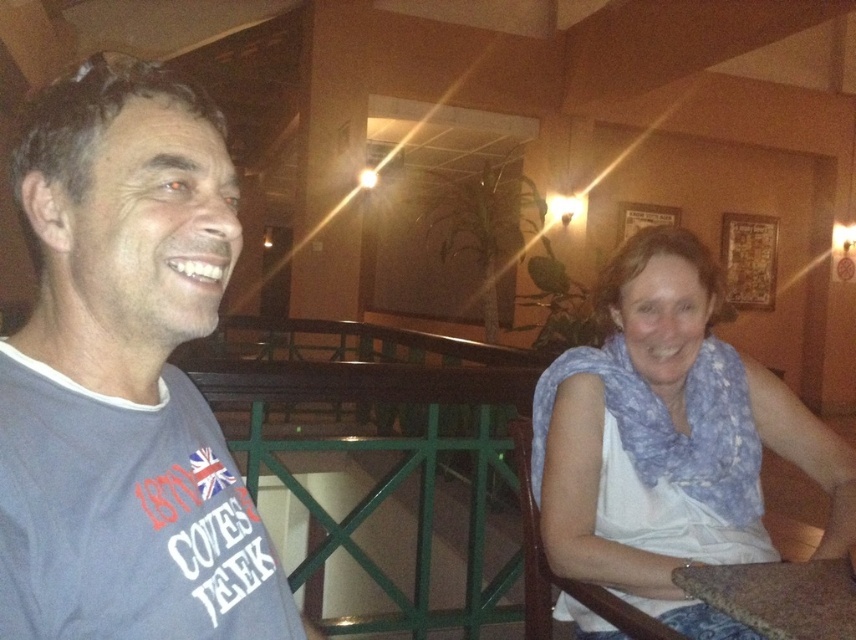
You are a photographer setting up for a group photo. You want to ensure that both the blue printed scarf at right and the brown fabric table at lower right are visible in the frame. Based on their positions, which object is closer to the camera?

The blue printed scarf at right is closer to the camera because the brown fabric table at lower right is behind it.

You are a photographer setting up a shoot in this room. You need to position a small lamp between the blue printed scarf at right and the brown fabric table at lower right. Based on their positions, where should the lamp be placed?

The blue printed scarf at right is above the brown fabric table at lower right, so the lamp should be placed below the blue printed scarf at right and above the brown fabric table at lower right to position it between them.